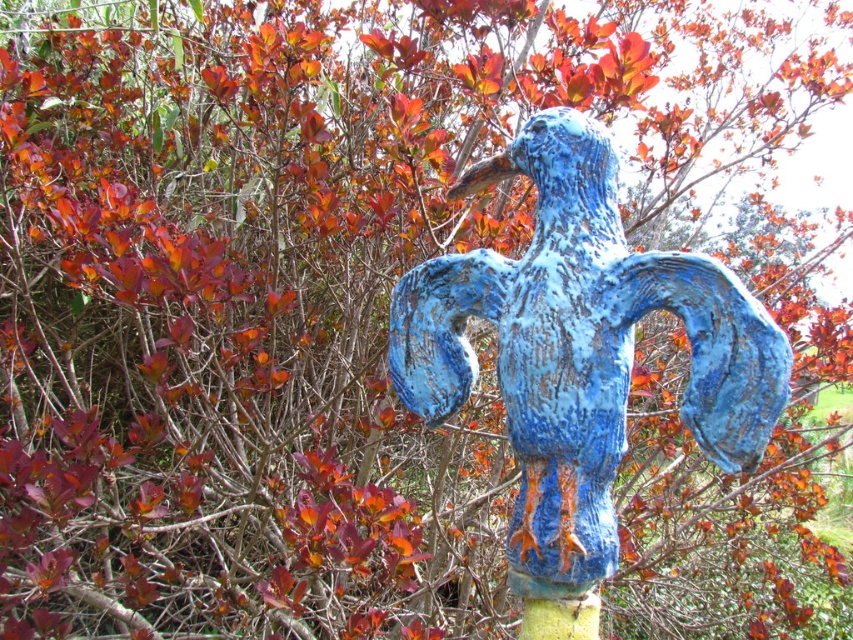
Question: In this image, where is blue chipped paint bird at center located relative to green mossy pole at center?

Choices:
 (A) right
 (B) left

Answer: (A)

Question: Among these objects, which one is farthest from the camera?

Choices:
 (A) blue chipped paint bird at center
 (B) green mossy pole at center

Answer: (B)

Question: Is blue chipped paint bird at center positioned behind green mossy pole at center?

Choices:
 (A) no
 (B) yes

Answer: (A)

Question: Which object appears closest to the camera in this image?

Choices:
 (A) green mossy pole at center
 (B) blue chipped paint bird at center

Answer: (B)

Question: Can you confirm if blue chipped paint bird at center is positioned above green mossy pole at center?

Choices:
 (A) no
 (B) yes

Answer: (B)